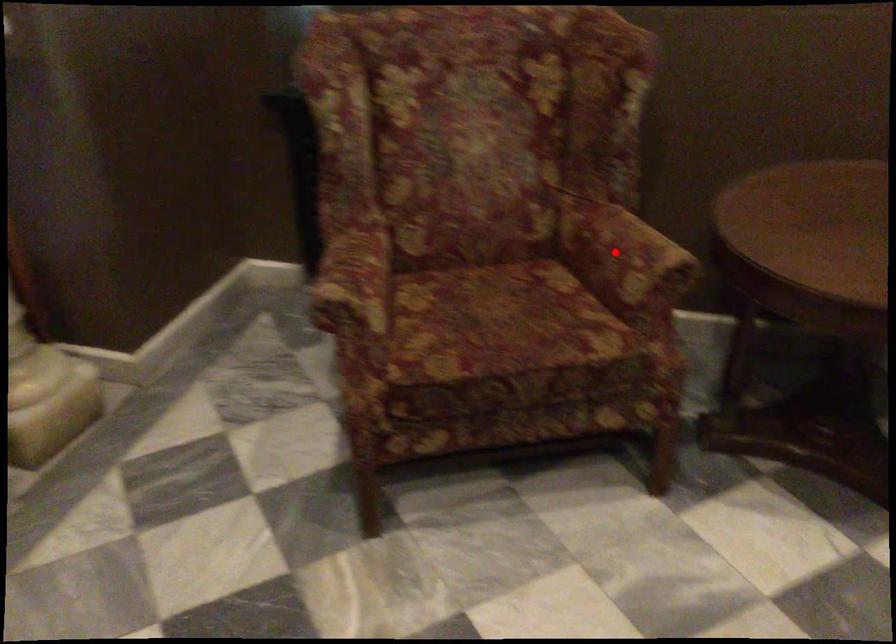
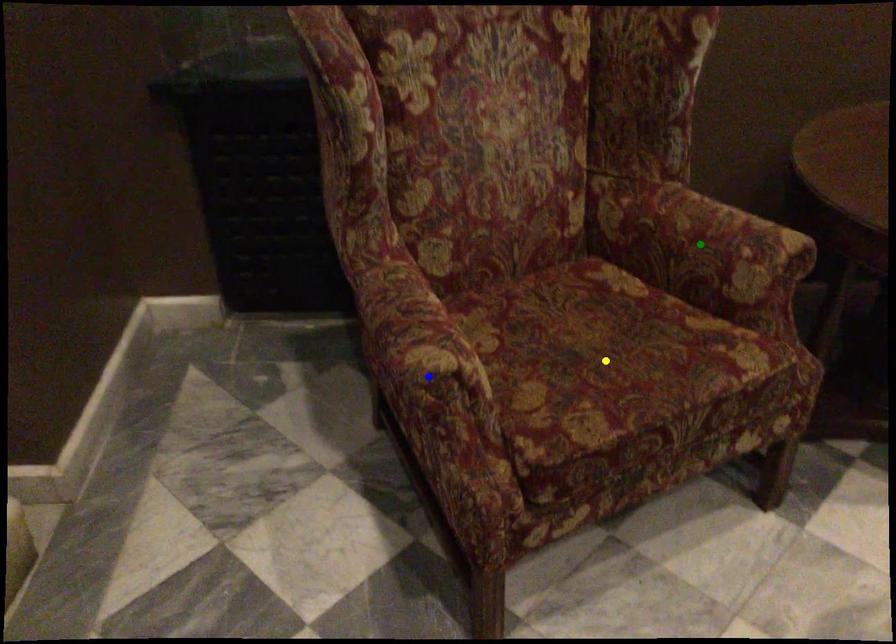
Question: I am providing you with two images of the same scene from different viewpoints. A red point is marked on the first image. You are given multiple points on the second image. Which spot in image 2 lines up with the point in image 1?

Choices:
 (A) blue point
 (B) green point
 (C) yellow point

Answer: (B)